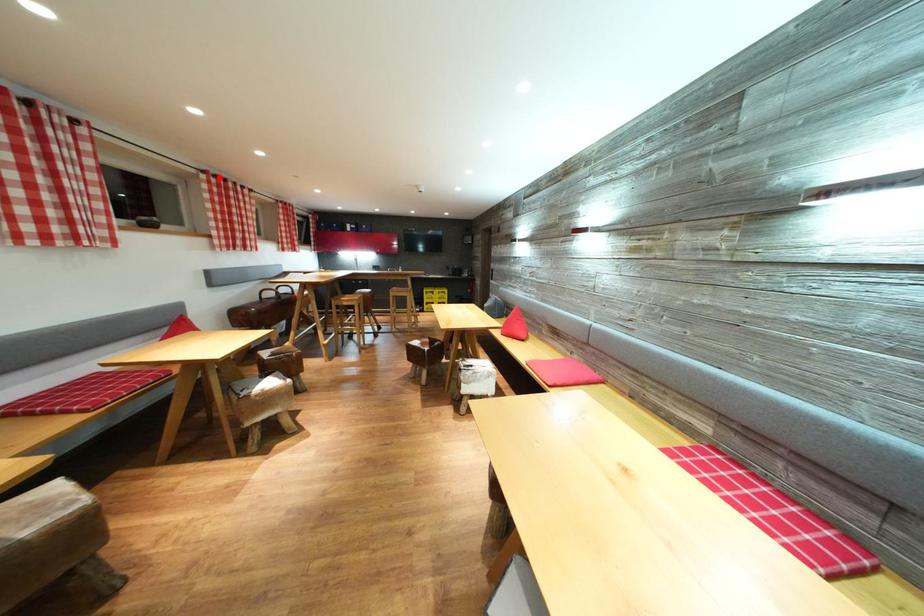
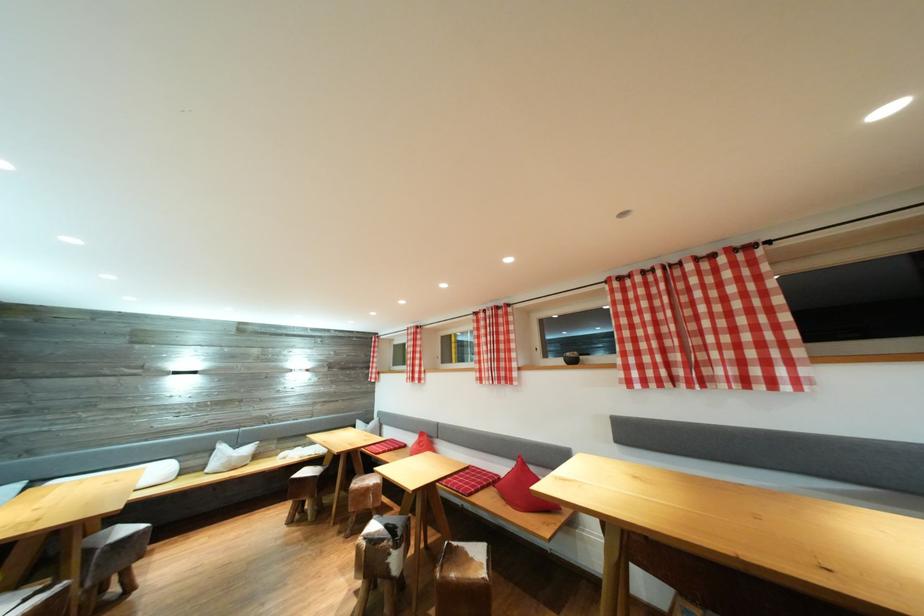
Find the pixel in the second image that matches the highlighted location in the first image.

(631, 278)